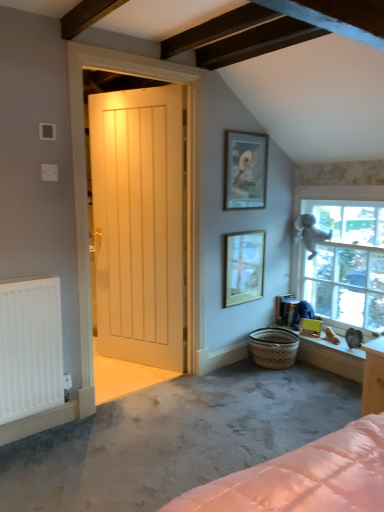
Describe the element at coordinates (244, 267) in the screenshot. I see `matte glass picture frame at center, which is the 2th picture frame from right to left` at that location.

Measure the distance between point [309,348] and camera.

The depth of point [309,348] is 3.15 meters.

In order to click on white wooden door at center in this screenshot , I will do `click(140, 224)`.

The image size is (384, 512). What do you see at coordinates (30, 347) in the screenshot?
I see `white matte radiator at lower left` at bounding box center [30, 347].

What do you see at coordinates (274, 347) in the screenshot? I see `woven natural basket at lower right` at bounding box center [274, 347].

Where is `matte wooden picture frame at upper center, which is the third picture frame in right-to-left order`? matte wooden picture frame at upper center, which is the third picture frame in right-to-left order is located at coordinates (245, 170).

You are a GUI agent. You are given a task and a screenshot of the screen. Output one action in this format:
    pyautogui.click(x=<x>, y=<y>)
    Task: Click on the gray carpet at lower left
    The height and width of the screenshot is (512, 384).
    Given the screenshot: What is the action you would take?
    pyautogui.click(x=174, y=438)

Find the location of a particular element. matte glass picture frame at center, positioned as the 2th picture frame in left-to-right order is located at coordinates (244, 267).

Is gray carpet at lower left at the left side of clear glass window at upper right?

Yes, gray carpet at lower left is to the left of clear glass window at upper right.

Can you confirm if gray carpet at lower left is thinner than clear glass window at upper right?

No, gray carpet at lower left is not thinner than clear glass window at upper right.

From a real-world perspective, between gray carpet at lower left and clear glass window at upper right, who is vertically lower?

gray carpet at lower left.

Is white matte radiator at lower left wider than woven natural basket at lower right?

No, white matte radiator at lower left is not wider than woven natural basket at lower right.

Can you see white matte radiator at lower left touching woven natural basket at lower right?

No, white matte radiator at lower left is not making contact with woven natural basket at lower right.

Is white matte radiator at lower left looking in the opposite direction of woven natural basket at lower right?

No, white matte radiator at lower left is not facing the opposite direction of woven natural basket at lower right.

How far apart are white matte radiator at lower left and woven natural basket at lower right?

white matte radiator at lower left and woven natural basket at lower right are 1.62 meters apart from each other.

How many degrees apart are the facing directions of woven natural basket at lower right and smooth white window sill at lower right?

The angular difference between woven natural basket at lower right and smooth white window sill at lower right is 0.000136 degrees.

Based on their sizes in the image, would you say woven natural basket at lower right is bigger or smaller than smooth white window sill at lower right?

In the image, woven natural basket at lower right appears to be larger than smooth white window sill at lower right.

I want to click on basket that appears behind the smooth white window sill at lower right, so click(x=274, y=347).

Which object is closer to the camera, woven natural basket at lower right or smooth white window sill at lower right?

Positioned in front is smooth white window sill at lower right.

Which is farther from the camera, (239, 143) or (321, 339)?

The point (321, 339) is more distant.

Relative to smooth white window sill at lower right, is matte wooden picture frame at upper center, the 1th picture frame from the top, in front or behind?

Clearly, matte wooden picture frame at upper center, the 1th picture frame from the top, is behind smooth white window sill at lower right.

Does matte wooden picture frame at upper center, the 1th picture frame from the top, touch smooth white window sill at lower right?

matte wooden picture frame at upper center, the 1th picture frame from the top, and smooth white window sill at lower right are not in contact.

Which object is thinner, clear glass window at upper right or white wooden door at center?

white wooden door at center is thinner.

Find the location of a particular element. The image size is (384, 512). window behind the white wooden door at center is located at coordinates (344, 255).

Is clear glass window at upper right placed right next to white wooden door at center?

No, clear glass window at upper right is not making contact with white wooden door at center.

Consider the image. How distant is clear glass window at upper right from white wooden door at center?

clear glass window at upper right and white wooden door at center are 1.30 meters apart.

Which is correct: clear glass window at upper right is inside smooth white window sill at lower right, or outside of it?

clear glass window at upper right is outside smooth white window sill at lower right.

From a real-world perspective, who is located lower, clear glass window at upper right or smooth white window sill at lower right?

smooth white window sill at lower right.

Is clear glass window at upper right positioned with its back to smooth white window sill at lower right?

No, clear glass window at upper right's orientation is not away from smooth white window sill at lower right.

Visually, is clear glass window at upper right positioned to the left or to the right of woven natural basket at lower right?

In the image, clear glass window at upper right appears on the right side of woven natural basket at lower right.

Identify the location of window located above the woven natural basket at lower right (from a real-world perspective). The width and height of the screenshot is (384, 512). (344, 255).

Is clear glass window at upper right looking in the opposite direction of woven natural basket at lower right?

No, clear glass window at upper right's orientation is not away from woven natural basket at lower right.

Find the location of a particular element. The image size is (384, 512). concrete on the left of clear glass window at upper right is located at coordinates (174, 438).

Find the location of `basket on the right of the white matte radiator at lower left`. basket on the right of the white matte radiator at lower left is located at coordinates (274, 347).

From the image, which object appears to be farther from smooth white window sill at lower right, gray carpet at lower left or woven natural basket at lower right?

Based on the image, gray carpet at lower left appears to be further to smooth white window sill at lower right.

From the picture: From the image, which object appears to be farther from gray carpet at lower left, matte wooden picture frame at upper center, the 1th picture frame from the top, or white wooden door at center?

matte wooden picture frame at upper center, the 1th picture frame from the top.

Which object lies nearer to the anchor point white wooden door at center, green matte picture frame at lower right, which ranks as the 3th picture frame in left-to-right order, or matte glass picture frame at center, which is the 2th picture frame from right to left?

matte glass picture frame at center, which is the 2th picture frame from right to left.

Estimate the real-world distances between objects in this image. Which object is further from white wooden door at center, matte glass picture frame at center, which is the 2th picture frame from right to left, or green matte picture frame at lower right, which ranks as the 3th picture frame in left-to-right order?

green matte picture frame at lower right, which ranks as the 3th picture frame in left-to-right order, lies further to white wooden door at center than the other object.

From the image, which object appears to be nearer to white matte radiator at lower left, matte wooden picture frame at upper center, which is the third picture frame in right-to-left order, or clear glass window at upper right?

matte wooden picture frame at upper center, which is the third picture frame in right-to-left order, is closer to white matte radiator at lower left.

Estimate the real-world distances between objects in this image. Which object is further from white matte radiator at lower left, matte glass picture frame at center, which ranks as the second picture frame in bottom-to-top order, or green matte picture frame at lower right, which ranks as the first picture frame in right-to-left order?

green matte picture frame at lower right, which ranks as the first picture frame in right-to-left order, is positioned further to the anchor white matte radiator at lower left.

Looking at the image, which one is located further to white matte radiator at lower left, gray carpet at lower left or woven natural basket at lower right?

Based on the image, woven natural basket at lower right appears to be further to white matte radiator at lower left.

Estimate the real-world distances between objects in this image. Which object is closer to white wooden door at center, green matte picture frame at lower right, the third picture frame in the top-to-bottom sequence, or clear glass window at upper right?

clear glass window at upper right.

The image size is (384, 512). Identify the location of window between gray carpet at lower left and matte glass picture frame at center, positioned as the 2th picture frame in left-to-right order, in the front-back direction. (344, 255).

You are a GUI agent. You are given a task and a screenshot of the screen. Output one action in this format:
    pyautogui.click(x=<x>, y=<y>)
    Task: Click on the door between matte wooden picture frame at upper center, which is the third picture frame in right-to-left order, and woven natural basket at lower right vertically
    This screenshot has height=512, width=384.
    Given the screenshot: What is the action you would take?
    pyautogui.click(x=140, y=224)

Image resolution: width=384 pixels, height=512 pixels. Identify the location of basket between white wooden door at center and clear glass window at upper right from left to right. (274, 347).

Find the location of `picture frame between matte wooden picture frame at upper center, placed as the 1th picture frame when sorted from left to right, and green matte picture frame at lower right, which is the 1th picture frame in bottom-to-top order, in the vertical direction`. picture frame between matte wooden picture frame at upper center, placed as the 1th picture frame when sorted from left to right, and green matte picture frame at lower right, which is the 1th picture frame in bottom-to-top order, in the vertical direction is located at coordinates (244, 267).